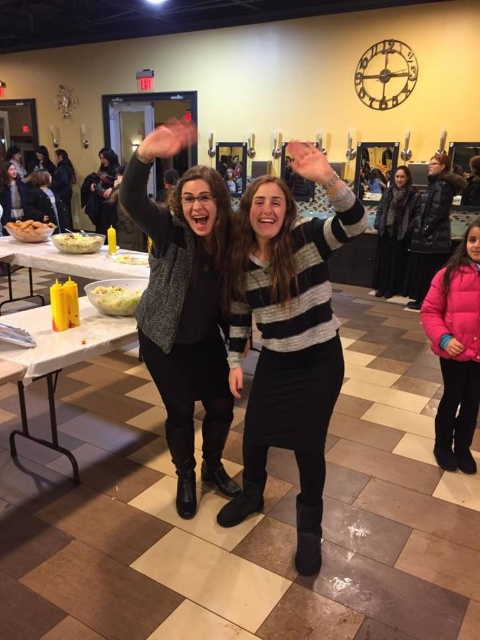
Question: Which of the following is the closest to the observer?

Choices:
 (A) yellow plastic containers at left
 (B) white creamy salad at left
 (C) white creamy salad at center

Answer: (C)

Question: Which point appears closest to the camera in this image?

Choices:
 (A) (17, 227)
 (B) (91, 260)

Answer: (B)

Question: Does yellow plastic containers at left appear on the left side of white creamy salad at left?

Choices:
 (A) no
 (B) yes

Answer: (A)

Question: Which of these objects is positioned closest to the matte black jacket at upper left?

Choices:
 (A) dark gray scarf at upper right
 (B) white creamy salad at center
 (C) striped sweater at center

Answer: (B)

Question: Can you confirm if golden fried chicken at lower left is positioned to the right of yellow plastic container at center?

Choices:
 (A) yes
 (B) no

Answer: (B)

Question: Does dark gray scarf at upper right appear on the right side of white creamy salad at center?

Choices:
 (A) yes
 (B) no

Answer: (A)